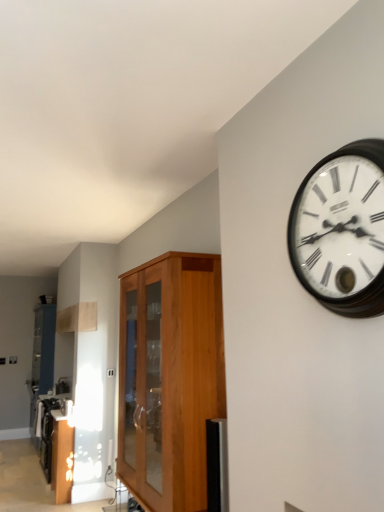
Question: Does wooden wall clock at upper right have a greater width compared to metallic stainless steel toaster at lower left?

Choices:
 (A) no
 (B) yes

Answer: (B)

Question: Is wooden wall clock at upper right shorter than metallic stainless steel toaster at lower left?

Choices:
 (A) yes
 (B) no

Answer: (B)

Question: Is wooden wall clock at upper right turned away from metallic stainless steel toaster at lower left?

Choices:
 (A) yes
 (B) no

Answer: (B)

Question: Is wooden wall clock at upper right far away from metallic stainless steel toaster at lower left?

Choices:
 (A) no
 (B) yes

Answer: (B)

Question: Is wooden wall clock at upper right oriented towards metallic stainless steel toaster at lower left?

Choices:
 (A) yes
 (B) no

Answer: (B)

Question: From a real-world perspective, is metallic stainless steel toaster at lower left physically located above or below wooden wall clock at upper right?

Choices:
 (A) above
 (B) below

Answer: (B)

Question: Is metallic stainless steel toaster at lower left to the left or to the right of wooden wall clock at upper right in the image?

Choices:
 (A) left
 (B) right

Answer: (A)

Question: Considering the positions of metallic stainless steel toaster at lower left and wooden wall clock at upper right in the image, is metallic stainless steel toaster at lower left bigger or smaller than wooden wall clock at upper right?

Choices:
 (A) big
 (B) small

Answer: (B)

Question: From the image's perspective, is metallic stainless steel toaster at lower left positioned above or below wooden wall clock at upper right?

Choices:
 (A) below
 (B) above

Answer: (A)

Question: Is wooden cabinet at center taller or shorter than metallic stainless steel toaster at lower left?

Choices:
 (A) short
 (B) tall

Answer: (B)

Question: Is point (193, 420) closer or farther from the camera than point (61, 402)?

Choices:
 (A) closer
 (B) farther

Answer: (A)

Question: Considering the positions of wooden cabinet at center and metallic stainless steel toaster at lower left in the image, is wooden cabinet at center bigger or smaller than metallic stainless steel toaster at lower left?

Choices:
 (A) small
 (B) big

Answer: (B)

Question: Is wooden cabinet at center in front of or behind metallic stainless steel toaster at lower left in the image?

Choices:
 (A) behind
 (B) front

Answer: (B)

Question: Considering their positions, is wooden cabinet at center located in front of or behind wooden wall clock at upper right?

Choices:
 (A) front
 (B) behind

Answer: (B)

Question: Would you say wooden cabinet at center is inside or outside wooden wall clock at upper right?

Choices:
 (A) inside
 (B) outside

Answer: (B)